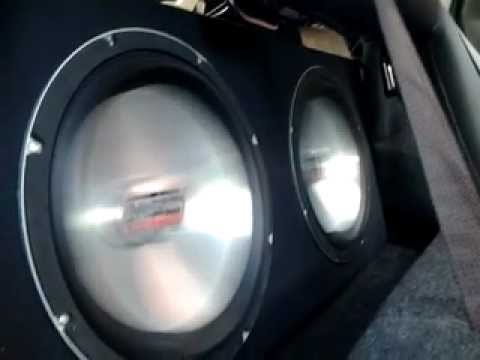
Image resolution: width=480 pixels, height=360 pixels. Find the location of `speakers`. speakers is located at coordinates (100, 207), (324, 119).